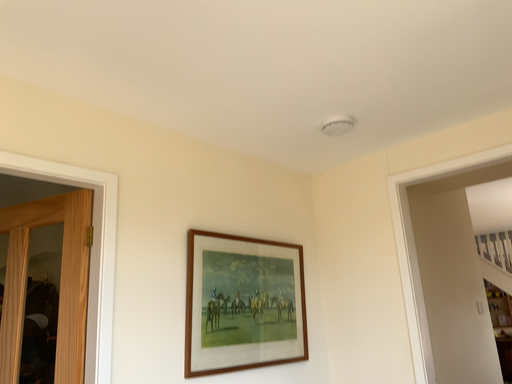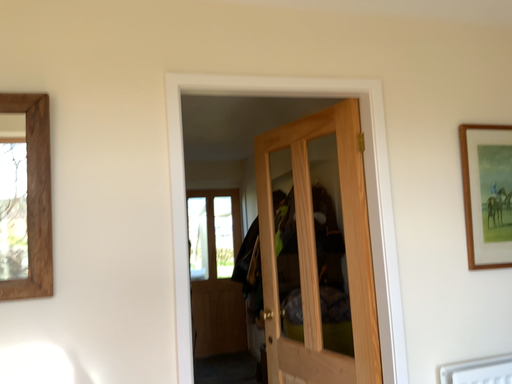
Question: Which way did the camera rotate in the video?

Choices:
 (A) rotated downward
 (B) rotated upward

Answer: (A)